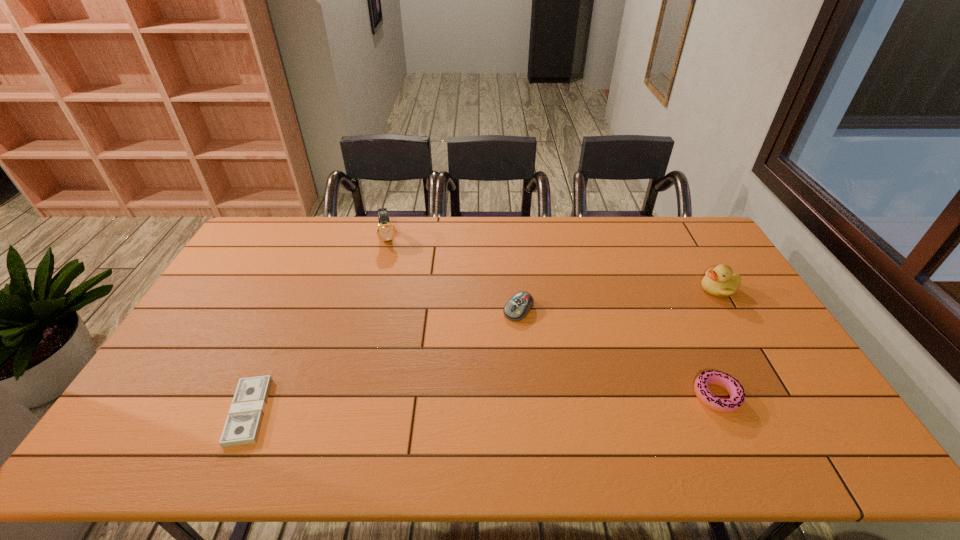
The width and height of the screenshot is (960, 540). In order to click on object that ranks as the third closest to the duckling in this screenshot , I will do `click(385, 231)`.

Identify which object is located as the nearest to the second tallest object. Please provide its 2D coordinates. Your answer should be formatted as a tuple, i.e. [(x, y)], where the tuple contains the x and y coordinates of a point satisfying the conditions above.

[(736, 391)]

The height and width of the screenshot is (540, 960). I want to click on free location that satisfies the following two spatial constraints: 1. on the back side of the rightmost object; 2. on the right side of the computer mouse, so click(x=516, y=289).

Locate an element on the screen. This screenshot has width=960, height=540. vacant position in the image that satisfies the following two spatial constraints: 1. on the back side of the leftmost object; 2. on the left side of the second object from left to right is located at coordinates (326, 238).

The width and height of the screenshot is (960, 540). What are the coordinates of `free space in the image that satisfies the following two spatial constraints: 1. on the back side of the dollar; 2. on the right side of the farthest object` in the screenshot? It's located at (326, 238).

At what (x,y) coordinates should I click in order to perform the action: click on free location that satisfies the following two spatial constraints: 1. on the back side of the dollar; 2. on the left side of the tallest object. Please return your answer as a coordinate pair (x, y). Image resolution: width=960 pixels, height=540 pixels. Looking at the image, I should click on tap(326, 238).